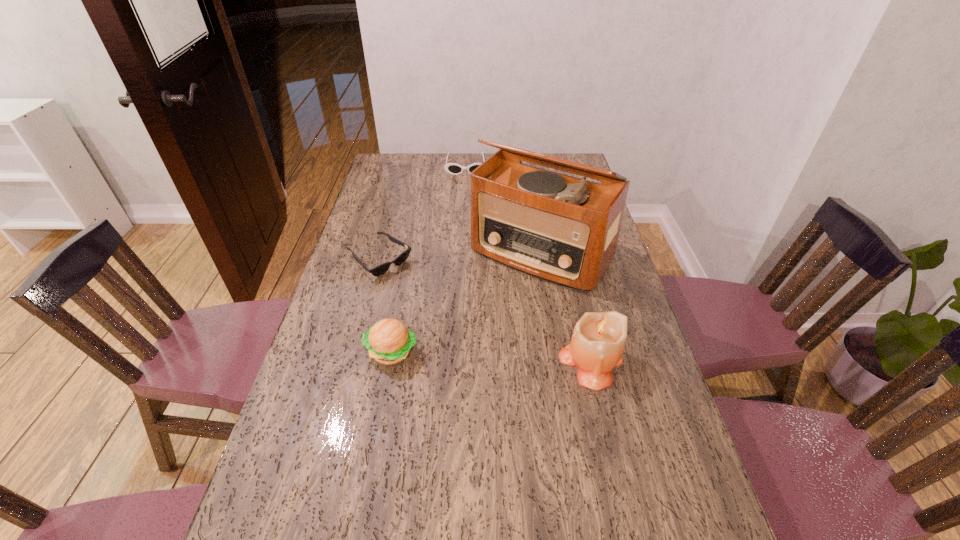
This screenshot has height=540, width=960. In order to click on vacant area between the farther sunglasses and the third tallest object in this screenshot , I will do `click(429, 259)`.

Find the location of `vacant space in between the third tallest object and the farther sunglasses`. vacant space in between the third tallest object and the farther sunglasses is located at coordinates (429, 259).

Locate an element on the screen. This screenshot has height=540, width=960. free space between the left sunglasses and the farther sunglasses is located at coordinates (422, 213).

I want to click on vacant space that is in between the left sunglasses and the radio receiver, so click(461, 256).

I want to click on object that is the second closest one to the farthest object, so click(x=376, y=271).

You are a GUI agent. You are given a task and a screenshot of the screen. Output one action in this format:
    pyautogui.click(x=<x>, y=<y>)
    Task: Click on the closest object relative to the tallest object
    The width and height of the screenshot is (960, 540).
    Given the screenshot: What is the action you would take?
    pyautogui.click(x=598, y=340)

I want to click on vacant space that satisfies the following two spatial constraints: 1. on the front side of the second tallest object; 2. on the left side of the third tallest object, so click(390, 361).

At what (x,y) coordinates should I click in order to perform the action: click on vacant space that satisfies the following two spatial constraints: 1. on the front side of the second tallest object; 2. on the left side of the tallest object. Please return your answer as a coordinate pair (x, y). The height and width of the screenshot is (540, 960). Looking at the image, I should click on (559, 361).

Find the location of a particular element. This screenshot has height=540, width=960. free point that satisfies the following two spatial constraints: 1. on the back side of the third tallest object; 2. on the left side of the tallest object is located at coordinates (410, 253).

The image size is (960, 540). Find the location of `vacant space that satisfies the following two spatial constraints: 1. on the back side of the tallest object; 2. on the left side of the hamburger`. vacant space that satisfies the following two spatial constraints: 1. on the back side of the tallest object; 2. on the left side of the hamburger is located at coordinates (410, 253).